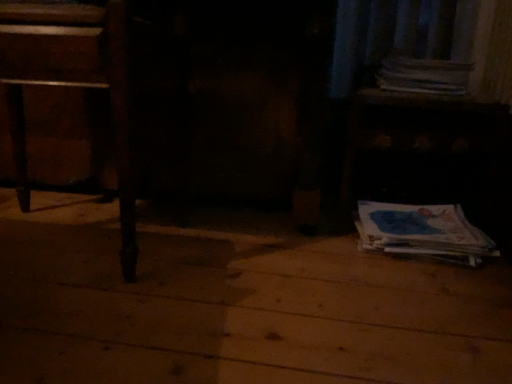
The width and height of the screenshot is (512, 384). Describe the element at coordinates (422, 232) in the screenshot. I see `blue paper at lower right, the second paperback book viewed from the top` at that location.

Find the location of a particular element. The height and width of the screenshot is (384, 512). wooden table at lower right is located at coordinates (425, 150).

From the image's perspective, which one is positioned higher, wooden table at left or white paper at upper right, which appears as the 2th paperback book when ordered from the bottom?

white paper at upper right, which appears as the 2th paperback book when ordered from the bottom, from the image's perspective.

From the picture: Between wooden table at left and white paper at upper right, the 1th paperback book positioned from the top, which one has less height?

white paper at upper right, the 1th paperback book positioned from the top.

Does point (130, 267) lie behind point (452, 75)?

No, it is in front of (452, 75).

Is wooden table at left bigger or smaller than white paper at upper right, the 1th paperback book positioned from the top?

wooden table at left is bigger than white paper at upper right, the 1th paperback book positioned from the top.

Considering the sizes of white paper at upper right, the 1th paperback book positioned from the top, and wooden table at left in the image, is white paper at upper right, the 1th paperback book positioned from the top, taller or shorter than wooden table at left?

Clearly, white paper at upper right, the 1th paperback book positioned from the top, is shorter compared to wooden table at left.

Can you see white paper at upper right, the 1th paperback book positioned from the top, touching wooden table at left?

No, white paper at upper right, the 1th paperback book positioned from the top, is not in contact with wooden table at left.

From the wooden table at left, count 2nd paperback book to the right and point to it. Please provide its 2D coordinates.

[(424, 75)]

Is white paper at upper right, the 1th paperback book positioned from the top, turned away from wooden table at left?

No, white paper at upper right, the 1th paperback book positioned from the top,'s orientation is not away from wooden table at left.

Is wooden table at lower right oriented away from blue paper at lower right, the first paperback book ordered from the bottom?

No, wooden table at lower right is not facing the opposite direction of blue paper at lower right, the first paperback book ordered from the bottom.

From a real-world perspective, is wooden table at lower right physically above blue paper at lower right, the second paperback book viewed from the top?

Indeed, from a real-world perspective, wooden table at lower right stands above blue paper at lower right, the second paperback book viewed from the top.

Considering the sizes of objects wooden table at lower right and blue paper at lower right, the second paperback book viewed from the top, in the image provided, who is thinner, wooden table at lower right or blue paper at lower right, the second paperback book viewed from the top,?

Thinner between the two is blue paper at lower right, the second paperback book viewed from the top.

How different are the orientations of wooden table at lower right and blue paper at lower right, the first paperback book ordered from the bottom, in degrees?

The facing directions of wooden table at lower right and blue paper at lower right, the first paperback book ordered from the bottom, are 0.000639 degrees apart.

Is white paper at upper right, which appears as the 2th paperback book when ordered from the bottom, oriented away from blue paper at lower right, the first paperback book ordered from the bottom?

No.

From the image's perspective, is white paper at upper right, the 1th paperback book positioned from the top, above blue paper at lower right, the first paperback book ordered from the bottom?

Yes.

Can you confirm if white paper at upper right, the 1th paperback book positioned from the top, is positioned to the right of blue paper at lower right, the second paperback book viewed from the top?

Yes.

Is white paper at upper right, the 1th paperback book positioned from the top, bigger than blue paper at lower right, the second paperback book viewed from the top?

Yes, white paper at upper right, the 1th paperback book positioned from the top, is bigger than blue paper at lower right, the second paperback book viewed from the top.

Between wooden table at left and wooden table at lower right, which one appears on the right side from the viewer's perspective?

wooden table at lower right is more to the right.

Is wooden table at left far away from wooden table at lower right?

Actually, wooden table at left and wooden table at lower right are a little close together.

From the image's perspective, is wooden table at left beneath wooden table at lower right?

Correct, wooden table at left appears lower than wooden table at lower right in the image.

From a real-world perspective, who is located lower, wooden table at left or wooden table at lower right?

wooden table at left is physically lower.

Is blue paper at lower right, the first paperback book ordered from the bottom, positioned with its back to white paper at upper right, the 1th paperback book positioned from the top?

No, blue paper at lower right, the first paperback book ordered from the bottom,'s orientation is not away from white paper at upper right, the 1th paperback book positioned from the top.

Does blue paper at lower right, the second paperback book viewed from the top, lie in front of white paper at upper right, the 1th paperback book positioned from the top?

Yes, it is.

Is blue paper at lower right, the second paperback book viewed from the top, situated inside white paper at upper right, which appears as the 2th paperback book when ordered from the bottom, or outside?

blue paper at lower right, the second paperback book viewed from the top, is located beyond the bounds of white paper at upper right, which appears as the 2th paperback book when ordered from the bottom.

Does point (449, 241) appear closer or farther from the camera than point (381, 70)?

Point (449, 241).

Considering the points (407, 85) and (505, 139), which point is behind, point (407, 85) or point (505, 139)?

Point (407, 85)

From the image's perspective, is white paper at upper right, which appears as the 2th paperback book when ordered from the bottom, positioned above or below wooden table at lower right?

Clearly, from the image's perspective, white paper at upper right, which appears as the 2th paperback book when ordered from the bottom, is above wooden table at lower right.

Which of these two, white paper at upper right, which appears as the 2th paperback book when ordered from the bottom, or wooden table at lower right, stands shorter?

Standing shorter between the two is white paper at upper right, which appears as the 2th paperback book when ordered from the bottom.

There is a wooden table at left. At what (x,y) coordinates should I click in order to perform the action: click on paperback book above it (from a real-world perspective). Please return your answer as a coordinate pair (x, y). This screenshot has height=384, width=512. Looking at the image, I should click on (424, 75).

Identify the location of furniture below the white paper at upper right, the 1th paperback book positioned from the top (from a real-world perspective). The width and height of the screenshot is (512, 384). coord(72,84).

Based on their spatial positions, is white paper at upper right, which appears as the 2th paperback book when ordered from the bottom, or blue paper at lower right, the first paperback book ordered from the bottom, further from wooden table at left?

white paper at upper right, which appears as the 2th paperback book when ordered from the bottom, is positioned further to the anchor wooden table at left.

Which object lies further to the anchor point wooden table at lower right, wooden table at left or white paper at upper right, the 1th paperback book positioned from the top?

wooden table at left is further to wooden table at lower right.

When comparing their distances from wooden table at lower right, does wooden table at left or blue paper at lower right, the second paperback book viewed from the top, seem further?

Based on the image, wooden table at left appears to be further to wooden table at lower right.

When comparing their distances from wooden table at lower right, does blue paper at lower right, the first paperback book ordered from the bottom, or wooden table at left seem closer?

Among the two, blue paper at lower right, the first paperback book ordered from the bottom, is located nearer to wooden table at lower right.

Which object lies further to the anchor point white paper at upper right, which appears as the 2th paperback book when ordered from the bottom, wooden table at left or wooden table at lower right?

wooden table at left is further to white paper at upper right, which appears as the 2th paperback book when ordered from the bottom.

Consider the image. Estimate the real-world distances between objects in this image. Which object is closer to blue paper at lower right, the first paperback book ordered from the bottom, wooden table at lower right or white paper at upper right, which appears as the 2th paperback book when ordered from the bottom?

wooden table at lower right.

Based on the photo, which object lies further to the anchor point wooden table at left, blue paper at lower right, the first paperback book ordered from the bottom, or wooden table at lower right?

The object further to wooden table at left is wooden table at lower right.

Estimate the real-world distances between objects in this image. Which object is closer to white paper at upper right, which appears as the 2th paperback book when ordered from the bottom, blue paper at lower right, the second paperback book viewed from the top, or wooden table at lower right?

Based on the image, wooden table at lower right appears to be nearer to white paper at upper right, which appears as the 2th paperback book when ordered from the bottom.

The width and height of the screenshot is (512, 384). I want to click on paperback book located between wooden table at left and white paper at upper right, the 1th paperback book positioned from the top, in the left-right direction, so click(422, 232).

The height and width of the screenshot is (384, 512). What are the coordinates of `table between white paper at upper right, which appears as the 2th paperback book when ordered from the bottom, and blue paper at lower right, the second paperback book viewed from the top, from top to bottom` in the screenshot? It's located at (425, 150).

Identify the location of paperback book between wooden table at left and wooden table at lower right from left to right. The width and height of the screenshot is (512, 384). (422, 232).

What are the coordinates of `table between wooden table at left and white paper at upper right, which appears as the 2th paperback book when ordered from the bottom, in the horizontal direction` in the screenshot? It's located at (425, 150).